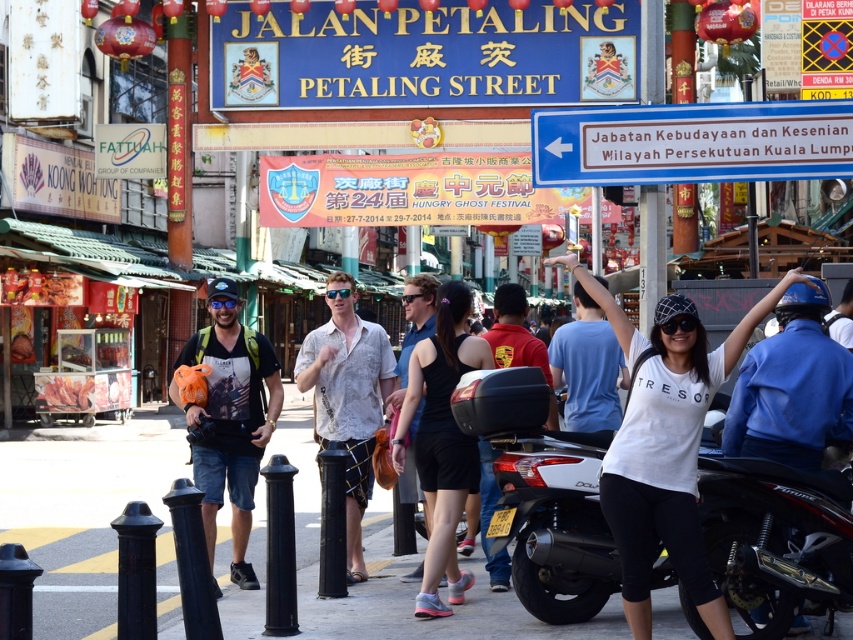
You are a photographer standing on Jalan Petaling and see both the white cotton shirt at center and the white textured shirt at center. Which shirt is closer to you?

The white cotton shirt at center is closer to you because it is in front of the white textured shirt at center.

You are standing at the point marked at (648,604). The Hungry Ghost Festival banner is 7.57 meters away from you. Can you safely walk towards the banner without any obstacles?

The distance between you and the Hungry Ghost Festival banner is 7.57 meters. Since the scene depicts a bustling market area with people walking and interacting, there might be obstacles like pedestrians or market stalls in your path. However, the question does not provide information about obstacles, so based on the given data, the distance is sufficient to walk towards the banner.

You are a vendor at Petaling Street and have two items for sale today. You have a blue fabric helmet at upper right and a blue fabric tank top at center. A customer asks which item is smaller. How do you respond?

The blue fabric helmet at upper right is smaller than the blue fabric tank top at center, so the blue fabric helmet at upper right is the smaller item.